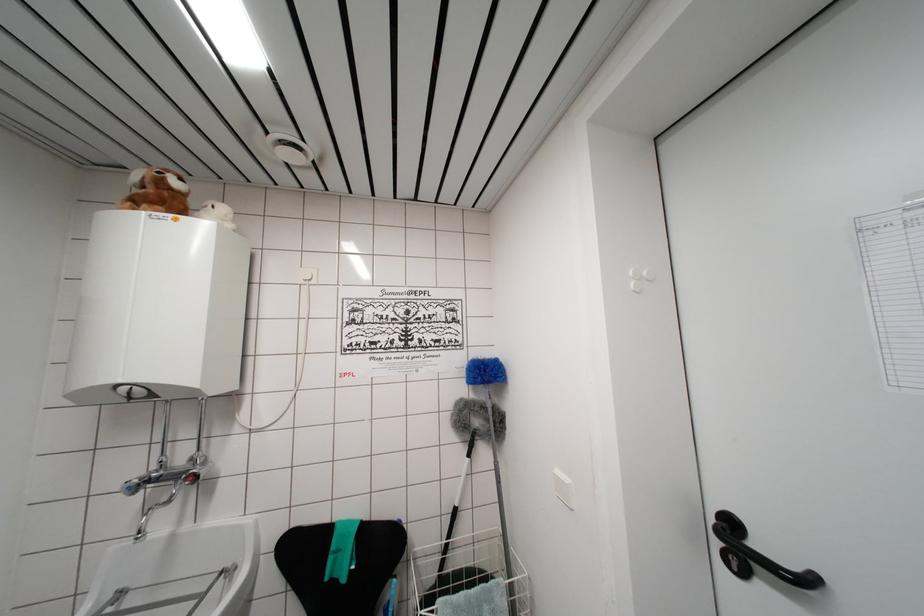
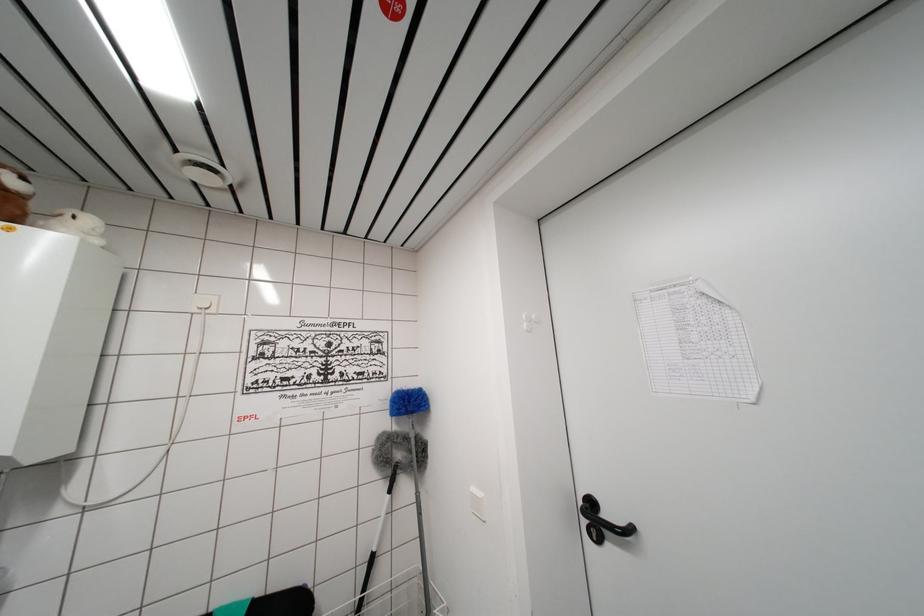
Question: The images are taken continuously from a first-person perspective. In which direction is your viewpoint rotating?

Choices:
 (A) Left
 (B) Right
 (C) Up
 (D) Down

Answer: (B)